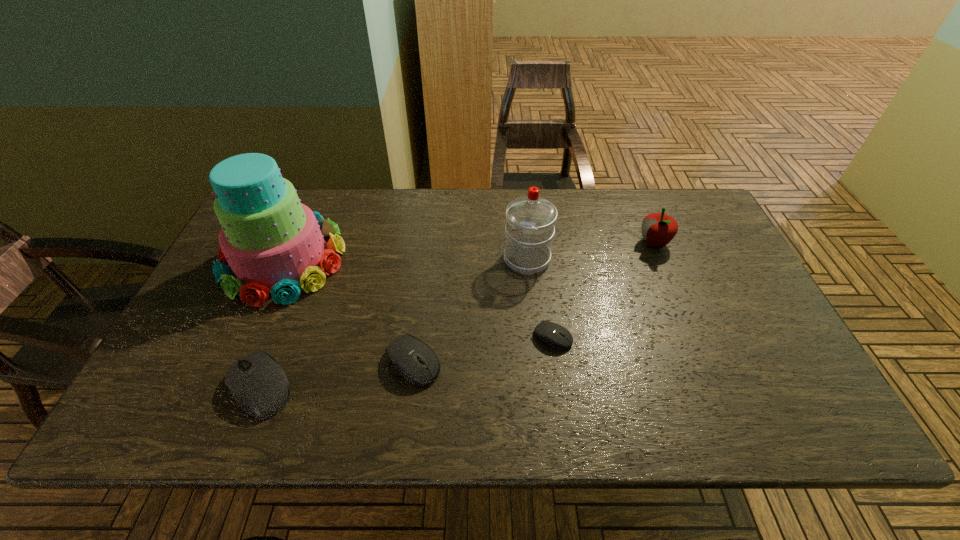
Find the location of a particular element. free point between the fourth shortest object and the rightmost computer equipment is located at coordinates (603, 290).

Where is `vacant space that is in between the shortest object and the fourth object from right to left`? The image size is (960, 540). vacant space that is in between the shortest object and the fourth object from right to left is located at coordinates (483, 349).

This screenshot has height=540, width=960. I want to click on free point between the second tallest computer equipment and the leftmost computer equipment, so click(337, 375).

You are a GUI agent. You are given a task and a screenshot of the screen. Output one action in this format:
    pyautogui.click(x=<x>, y=<y>)
    Task: Click on the empty space between the third tallest object and the second tallest object
    The image size is (960, 540).
    Given the screenshot: What is the action you would take?
    pyautogui.click(x=590, y=251)

Find the location of a particular element. The image size is (960, 540). free space between the fifth shortest object and the fourth shortest object is located at coordinates pyautogui.click(x=590, y=251).

Identify the location of empty location between the third object from left to right and the water bottle. This screenshot has height=540, width=960. (470, 310).

Locate an element on the screen. the third closest object relative to the shortest computer equipment is located at coordinates (658, 229).

Where is `the fourth closest object relative to the leftmost computer equipment`? The image size is (960, 540). the fourth closest object relative to the leftmost computer equipment is located at coordinates (530, 219).

Locate which computer equipment ranks second in proximity to the rightmost object. Please provide its 2D coordinates. Your answer should be formatted as a tuple, i.e. [(x, y)], where the tuple contains the x and y coordinates of a point satisfying the conditions above.

[(403, 351)]

In order to click on the closest computer equipment to the leftmost computer equipment in this screenshot , I will do `click(403, 351)`.